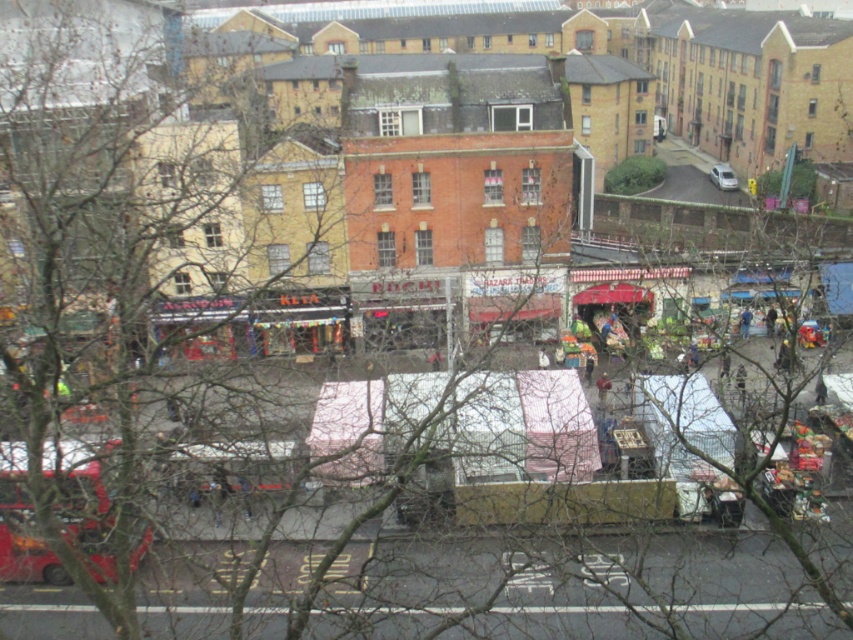
Who is positioned more to the left, red matte bus at lower left or blue fabric at center?

From the viewer's perspective, red matte bus at lower left appears more on the left side.

Between red matte bus at lower left and blue fabric at center, which one has more height?

red matte bus at lower left

Between point (28, 506) and point (741, 317), which one is positioned behind?

Positioned behind is point (741, 317).

You are a GUI agent. You are given a task and a screenshot of the screen. Output one action in this format:
    pyautogui.click(x=<x>, y=<y>)
    Task: Click on the red matte bus at lower left
    
    Given the screenshot: What is the action you would take?
    pyautogui.click(x=21, y=525)

Which is behind, point (601, 392) or point (744, 320)?

The point (744, 320) is more distant.

Can you confirm if brown leather jacket at center is bigger than blue fabric at center?

Correct, brown leather jacket at center is larger in size than blue fabric at center.

Who is more forward, [601,396] or [741,317]?

Point [601,396]

At what (x,y) coordinates should I click in order to perform the action: click on brown leather jacket at center. Please return your answer as a coordinate pair (x, y). This screenshot has width=853, height=640. Looking at the image, I should click on 602,387.

Is red matte bus at lower left below white matte van at upper right?

Yes.

In the scene shown: Who is more distant from viewer, (1, 509) or (711, 177)?

The point (711, 177) is behind.

Identify the location of red matte bus at lower left. (21, 525).